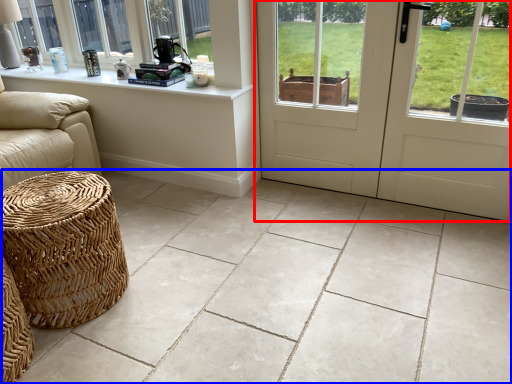
Question: Which object is closer to the camera taking this photo, door (highlighted by a red box) or ceramic tile (highlighted by a blue box)?

Choices:
 (A) door
 (B) ceramic tile

Answer: (B)